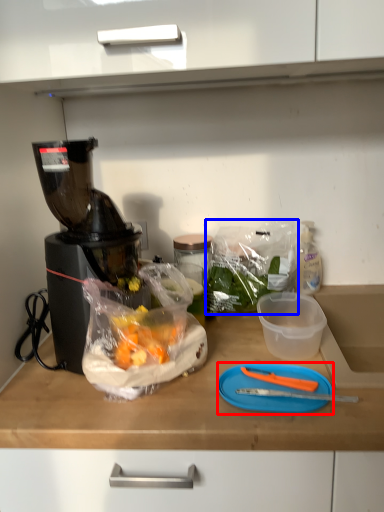
Question: Which of the following is the closest to the observer, cutting board (highlighted by a red box) or plastic bag (highlighted by a blue box)?

Choices:
 (A) cutting board
 (B) plastic bag

Answer: (A)